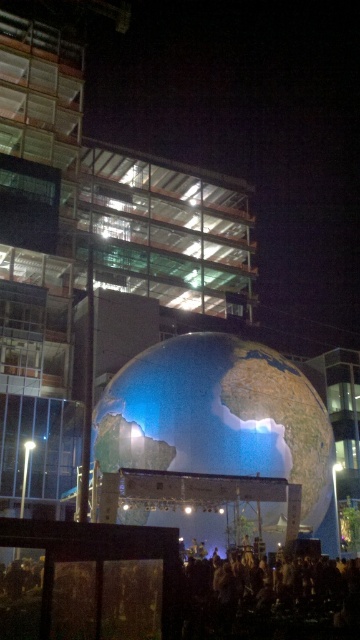
You are standing in front of the illuminated globe at night. There are two points marked on the globe, one at point coordinates point (164, 388) and the other at point (255, 564). Which point is closer to you?

Point (164, 388) is closer to you because it is further to the viewer than point (255, 564).

You are an event organizer trying to set up a photo booth. You want to place it in a location where it can be seen from both the shiny metallic globe at center and the dark textured crowd at lower center. Based on their positions, where should you position the photo booth?

The photo booth should be placed to the right of the shiny metallic globe at center since it is to the left of the dark textured crowd at lower center, allowing visibility from both locations.

You are standing at the front of the stage behind the shiny metallic globe at center and want to walk towards the dark textured crowd at lower center. Which direction should you move to reach them?

You should move forward towards the dark textured crowd at lower center since the shiny metallic globe at center is between you and the crowd, meaning the crowd is located behind the globe from your current position.